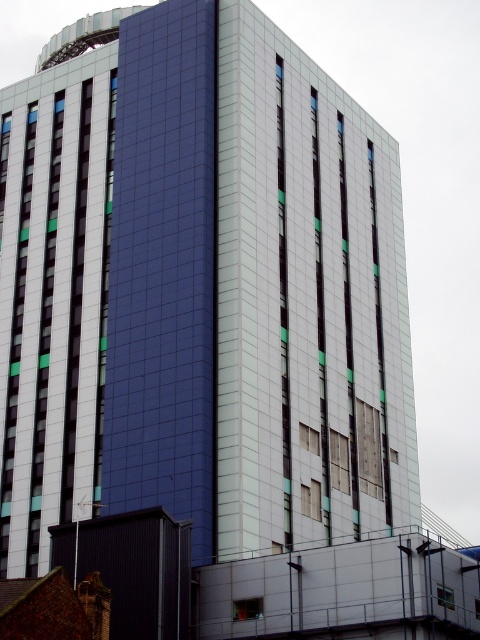
How much distance is there between clear glass window at center and transparent glass window at lower right?

They are 17.85 meters apart.

Who is lower down, clear glass window at center or transparent glass window at lower right?

Positioned lower is transparent glass window at lower right.

This screenshot has width=480, height=640. What do you see at coordinates (309, 438) in the screenshot?
I see `clear glass window at center` at bounding box center [309, 438].

Find the location of a particular element. This screenshot has height=640, width=480. clear glass window at center is located at coordinates (309, 438).

Can you confirm if transparent glass window at center is shorter than clear glass window at center?

Yes.

Measure the distance between transparent glass window at center and camera.

transparent glass window at center and camera are 157.63 feet apart.

I want to click on transparent glass window at center, so click(248, 609).

Who is positioned more to the right, transparent glass window at center or transparent glass window at lower right?

From the viewer's perspective, transparent glass window at lower right appears more on the right side.

Can you confirm if transparent glass window at center is shorter than transparent glass window at lower right?

Indeed, transparent glass window at center has a lesser height compared to transparent glass window at lower right.

Which is behind, point (242, 611) or point (453, 602)?

Point (242, 611)

Locate an element on the screen. The height and width of the screenshot is (640, 480). transparent glass window at center is located at coordinates (248, 609).